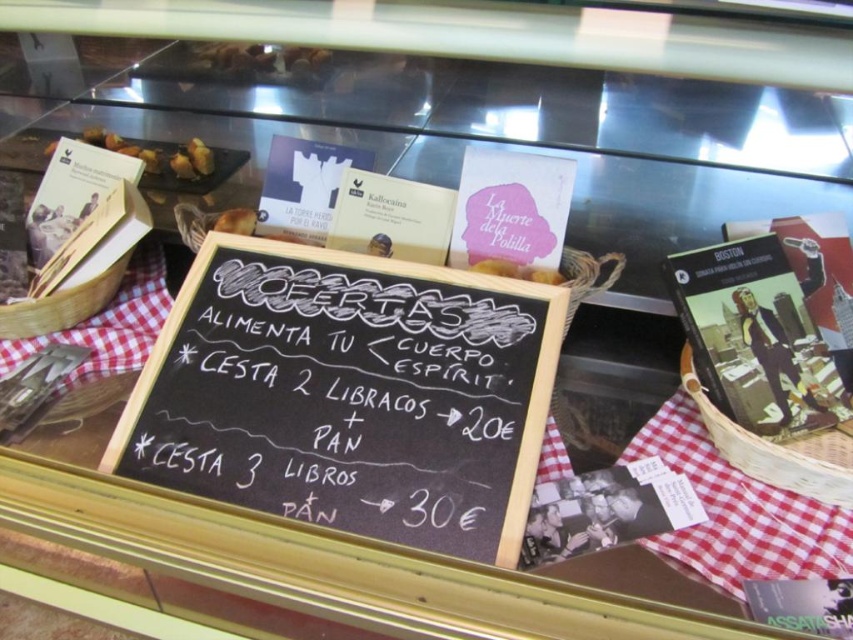
Is black chalkboard at center wider than matte brown bread at upper left?

Indeed, black chalkboard at center has a greater width compared to matte brown bread at upper left.

I want to click on black chalkboard at center, so click(349, 394).

Can you confirm if golden brown bread at center is positioned below matte brown bread at upper left?

Correct, golden brown bread at center is located below matte brown bread at upper left.

Between golden brown bread at center and matte brown bread at upper left, which one is positioned lower?

golden brown bread at center

Does point (471, 269) come farther from viewer compared to point (224, 216)?

No, it is in front of (224, 216).

Find the location of `golden brown bread at center`. golden brown bread at center is located at coordinates (517, 269).

Is black chalkboard at center wider than golden brown bread at center?

Indeed, black chalkboard at center has a greater width compared to golden brown bread at center.

Is black chalkboard at center shorter than golden brown bread at center?

In fact, black chalkboard at center may be taller than golden brown bread at center.

Find the location of `black chalkboard at center`. black chalkboard at center is located at coordinates (349, 394).